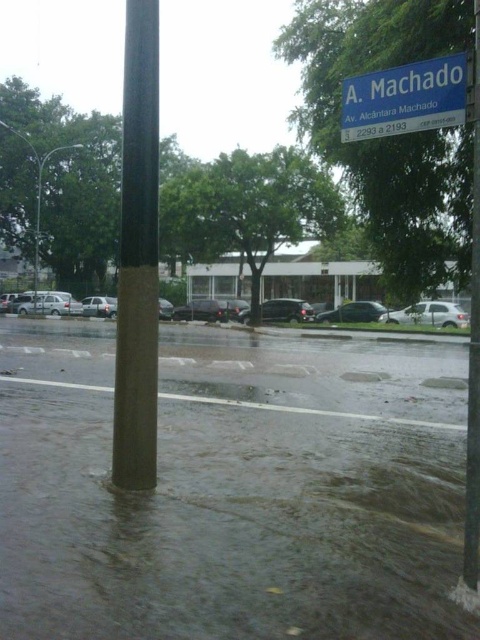
You are driving a shiny silver sedan at center and need to navigate around the concrete pole at center. Given their sizes, can you safely maneuver around the pole without touching it?

The concrete pole at center is wider than the shiny silver sedan at center, so you can safely maneuver around it as long as you maintain a sufficient distance from the pole.

You are driving a shiny silver sedan at center and want to park it near the concrete pole at center. Given that your car requires a parking space of 20 feet in length, can you safely park your car between them without any obstruction?

The concrete pole at center is 49.55 feet away from the shiny silver sedan at center. Since the required parking space is 20 feet, there is sufficient space between them to park safely without obstruction.